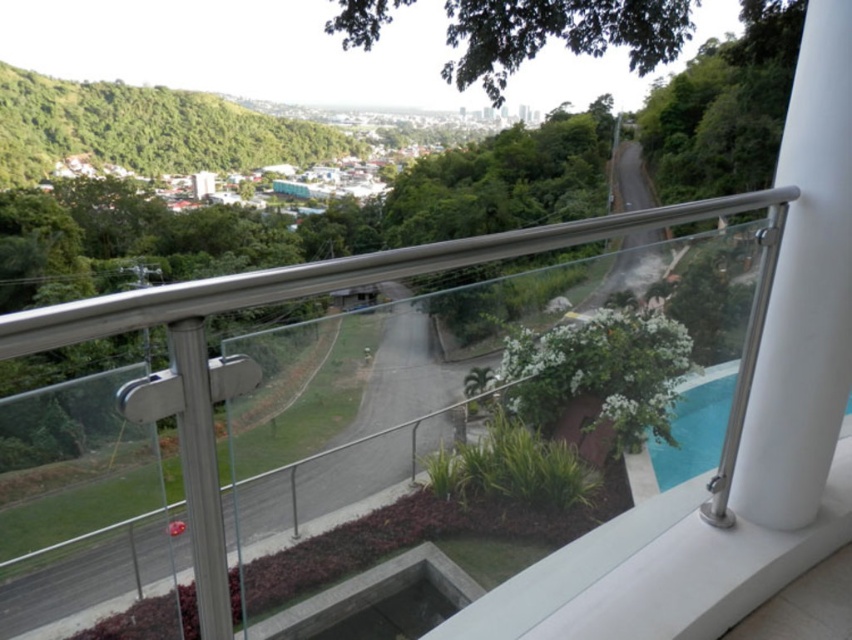
You are designing a new outdoor space and want to ensure proper spacing between the white glossy pillar at right and the satin silver railing at upper center. Given their widths, which object requires more space when placing them side by side?

The satin silver railing at upper center requires more space when placing them side by side because its width is greater than the white glossy pillar at right.

You are standing on the balcony and want to take a photo of the distant urban area. The camera you are using has a focal length of 50mm. To ensure the satin silver railing at upper center does not block the view, how far back should you step from the railing?

The satin silver railing at upper center is 3.52 feet away from the camera. To avoid blocking the view of the distant urban area, you should step back at least 3.52 feet from the railing to ensure it is out of frame.